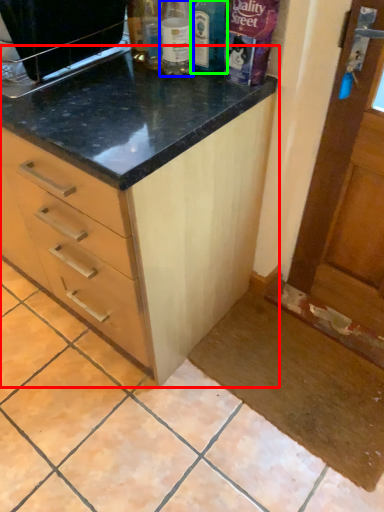
Question: Estimate the real-world distances between objects in this image. Which object is farther from cabinetry (highlighted by a red box), bottle (highlighted by a blue box) or bottle (highlighted by a green box)?

Choices:
 (A) bottle
 (B) bottle

Answer: (B)